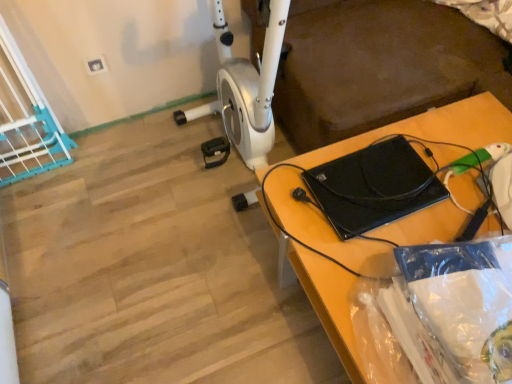
Describe the element at coordinates (431, 129) in the screenshot. This screenshot has height=384, width=512. I see `black matte laptop at right` at that location.

What is the approximate height of black matte laptop at right?

It is 15.55 inches.

Image resolution: width=512 pixels, height=384 pixels. In order to click on black matte laptop at right in this screenshot , I will do `click(431, 129)`.

Locate an element on the screen. The width and height of the screenshot is (512, 384). black matte laptop at right is located at coordinates (431, 129).